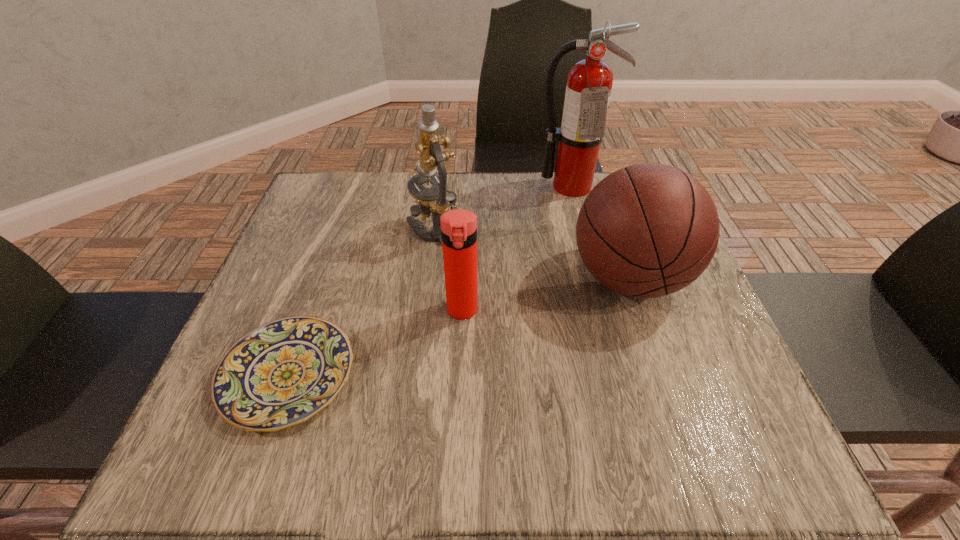
In order to click on free space located 0.290m on the back of the thermos bottle in this screenshot , I will do `click(466, 211)`.

Where is `free space located on the back of the leftmost object`? This screenshot has height=540, width=960. free space located on the back of the leftmost object is located at coordinates (348, 204).

Locate an element on the screen. The height and width of the screenshot is (540, 960). fire extinguisher located at the far edge is located at coordinates (589, 82).

Find the location of `microscope located at the far edge`. microscope located at the far edge is located at coordinates (436, 200).

Where is `object located in the near edge section of the desktop`? The width and height of the screenshot is (960, 540). object located in the near edge section of the desktop is located at coordinates (x=282, y=373).

Image resolution: width=960 pixels, height=540 pixels. Find the location of `object that is at the left edge`. object that is at the left edge is located at coordinates (282, 373).

Where is `fire extinguisher that is at the right edge`? This screenshot has width=960, height=540. fire extinguisher that is at the right edge is located at coordinates (589, 82).

I want to click on basketball that is at the right edge, so click(x=648, y=230).

I want to click on object that is at the near left corner, so click(x=282, y=373).

Find the location of `object positioned at the far right corner`. object positioned at the far right corner is located at coordinates (589, 82).